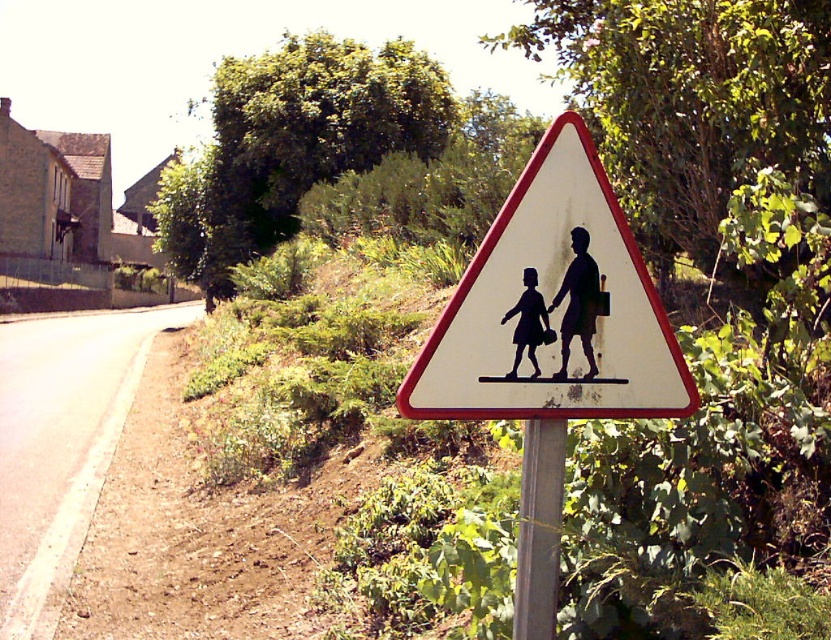
Which is in front, point (441, 401) or point (532, 307)?

Point (441, 401) is more forward.

Based on the photo, who is positioned more to the right, white matte triangle at center or silhouette paper child at center?

From the viewer's perspective, silhouette paper child at center appears more on the right side.

Locate an element on the screen. This screenshot has width=831, height=640. white matte triangle at center is located at coordinates (552, 308).

Is the position of metallic silver pole at center more distant than that of silhouette paper child at center?

Yes, it is behind silhouette paper child at center.

How far apart are metallic silver pole at center and silhouette paper child at center?

metallic silver pole at center is 15.05 inches from silhouette paper child at center.

Does point (536, 461) come farther from viewer compared to point (546, 339)?

Yes, point (536, 461) is farther from viewer.

The height and width of the screenshot is (640, 831). Find the location of `metallic silver pole at center`. metallic silver pole at center is located at coordinates (539, 529).

Looking at this image, does white matte triangle at center have a larger size compared to metallic silver pole at center?

Yes.

Does white matte triangle at center have a smaller size compared to metallic silver pole at center?

Incorrect, white matte triangle at center is not smaller in size than metallic silver pole at center.

You are a GUI agent. You are given a task and a screenshot of the screen. Output one action in this format:
    pyautogui.click(x=<x>, y=<y>)
    Task: Click on the white matte triangle at center
    Image resolution: width=831 pixels, height=640 pixels.
    Given the screenshot: What is the action you would take?
    pyautogui.click(x=552, y=308)

Identify the location of white matte triangle at center. (552, 308).